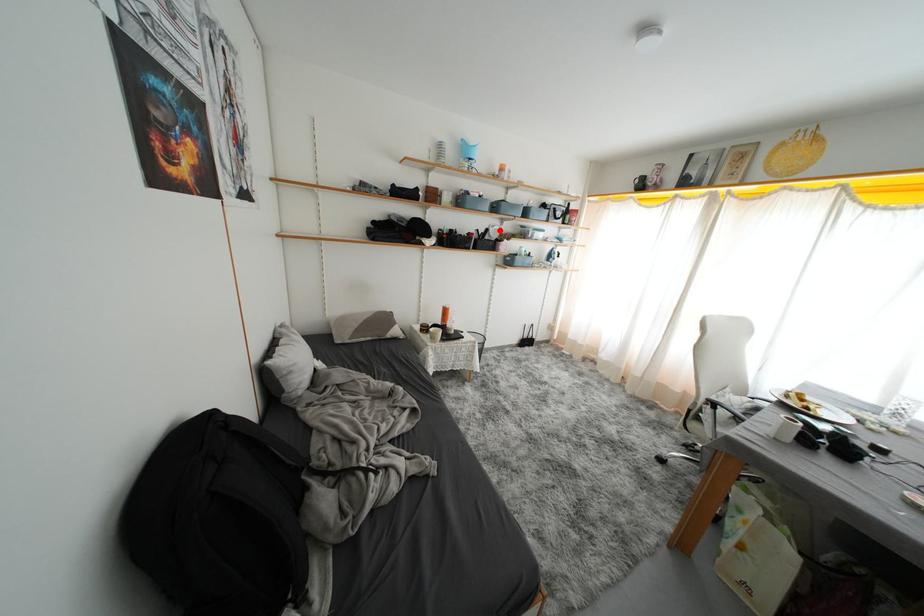
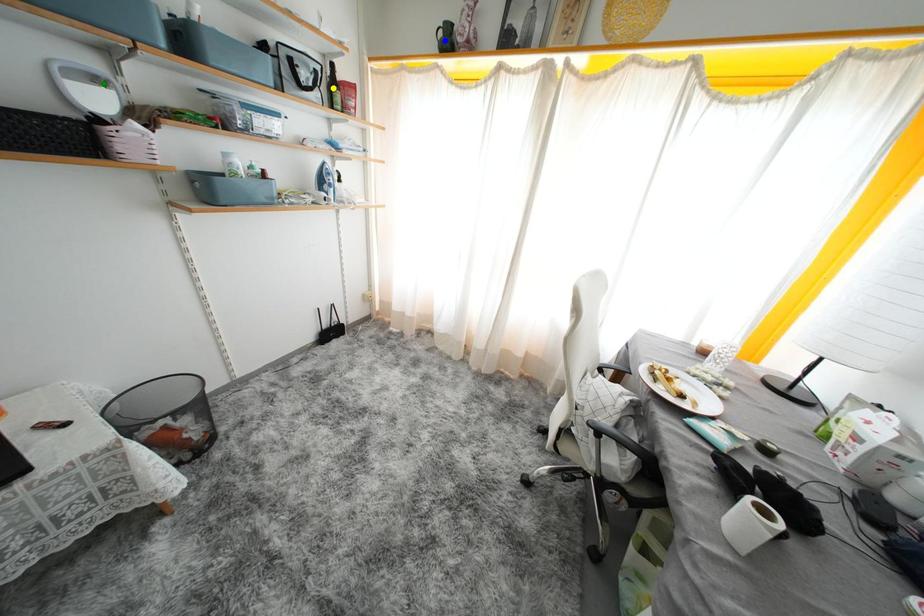
Question: I am providing you with two images of the same scene from different viewpoints. A red point is marked on the first image. You are given multiple points on the second image. Which mark in image 2 goes with the point in image 1?

Choices:
 (A) green point
 (B) yellow point
 (C) blue point

Answer: (A)